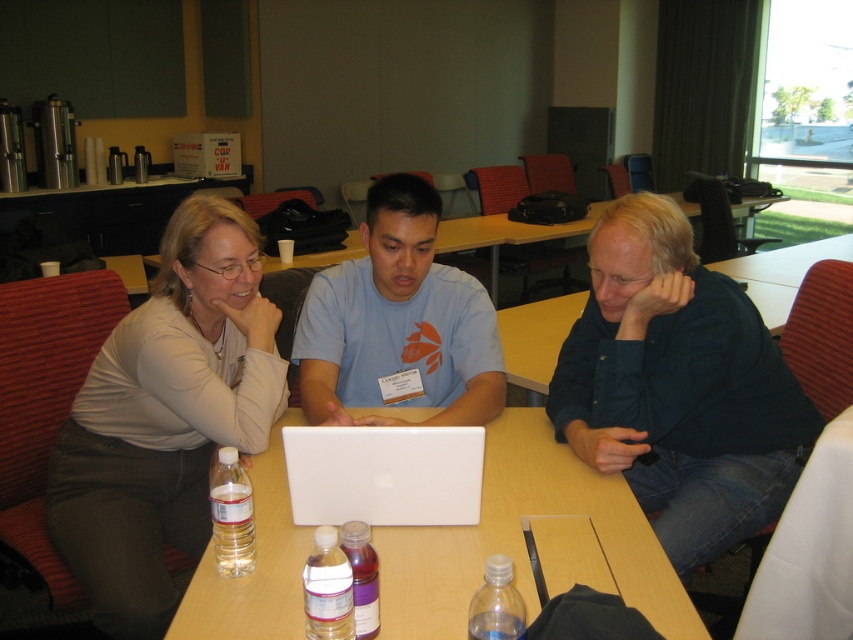
Based on the photo, you are sitting at the wooden table at center and want to pass a document to the person wearing the dark blue shirt at center. In which direction should you pass the document?

The dark blue shirt at center is to the right of the wooden table at center, so you should pass the document to the right.

You are standing in the conference room and want to place a small object exactly at the point marked as point [523,540]. Which object from the scene is this point located on?

The point [523,540] is located on the white plastic table at center.